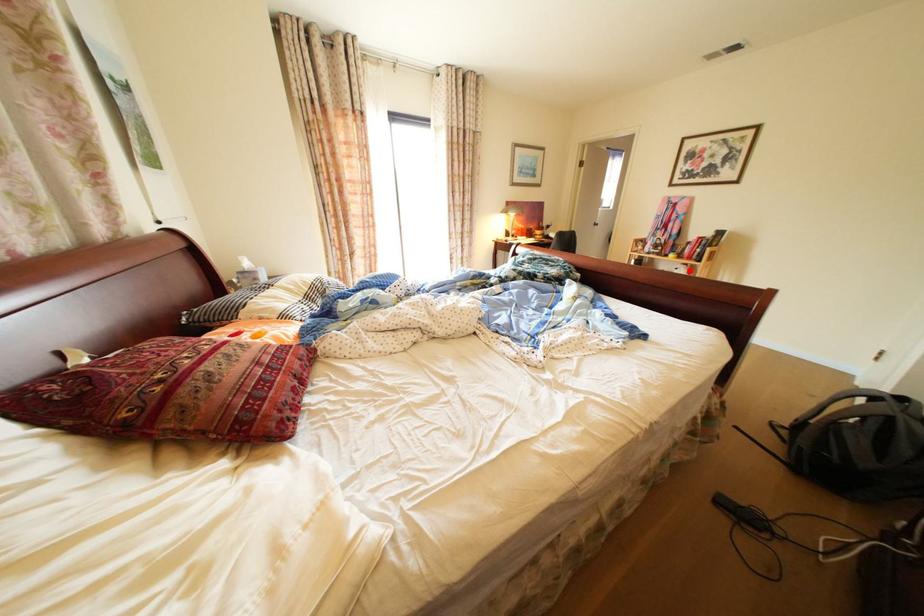
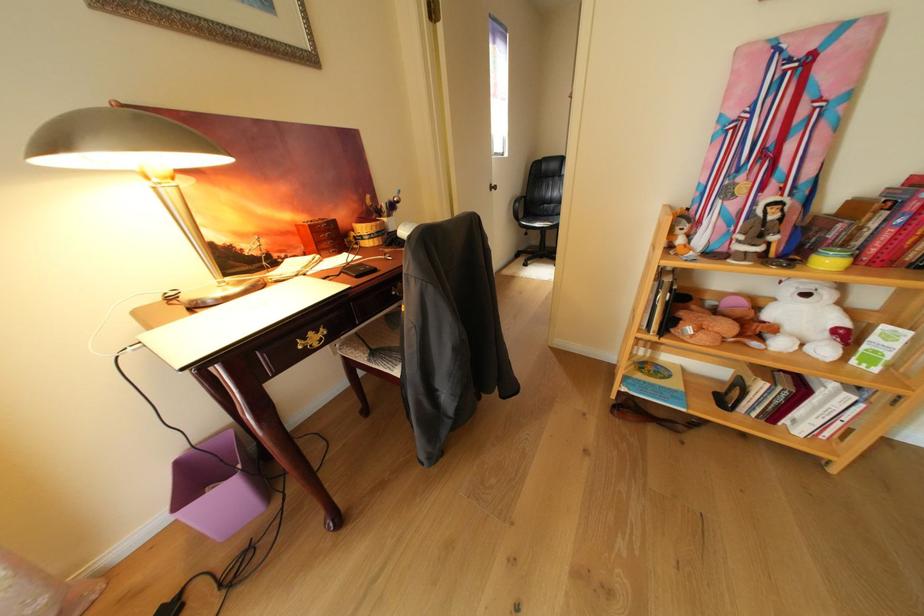
The point at the highlighted location is marked in the first image. Where is the corresponding point in the second image?

(820, 297)